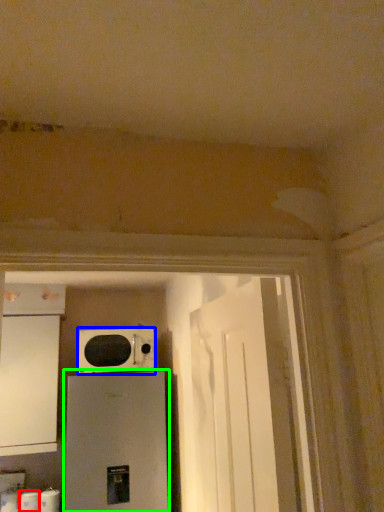
Question: Which object is the closest to the toilet paper (highlighted by a red box)? Choose among these: microwave oven (highlighted by a blue box) or home appliance (highlighted by a green box).

Choices:
 (A) microwave oven
 (B) home appliance

Answer: (B)